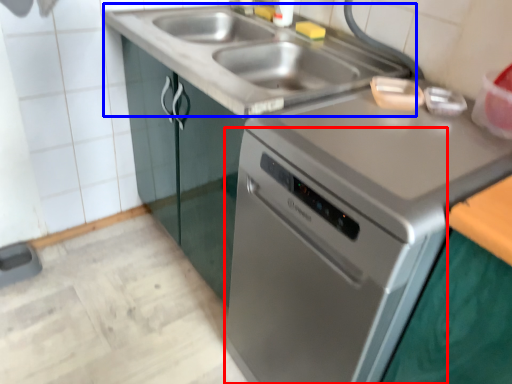
Question: Among these objects, which one is nearest to the camera, oven (highlighted by a red box) or sink (highlighted by a blue box)?

Choices:
 (A) oven
 (B) sink

Answer: (A)